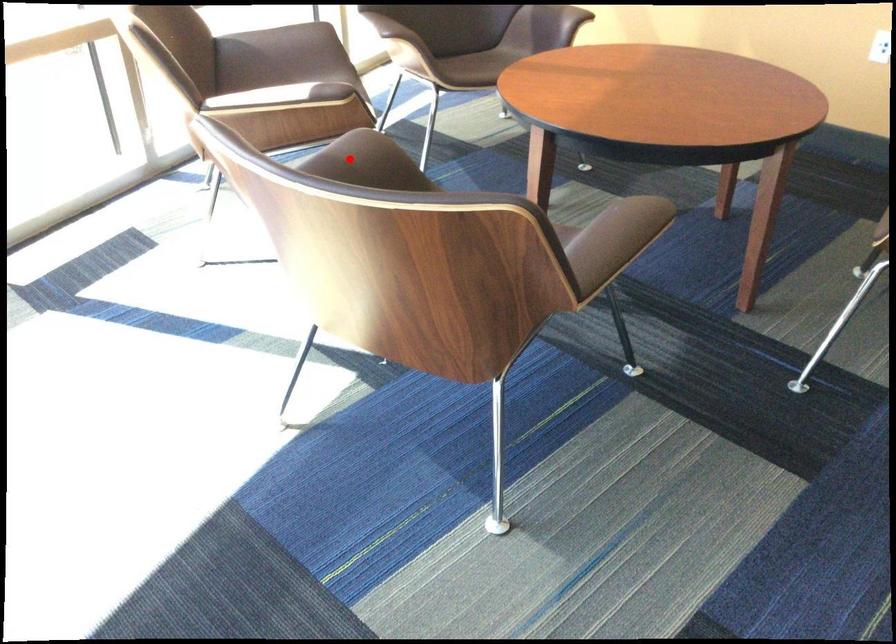
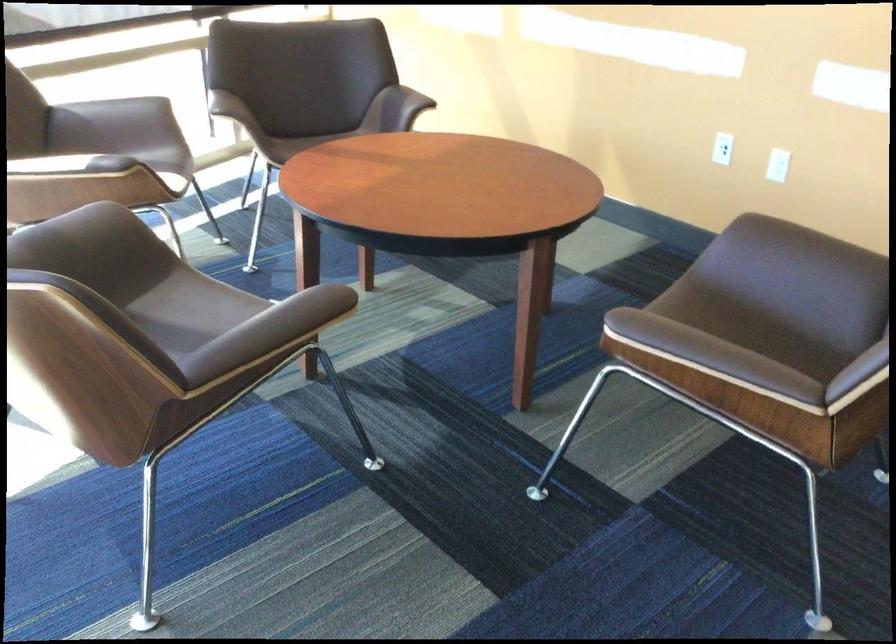
Find the pixel in the second image that matches the highlighted location in the first image.

(76, 232)